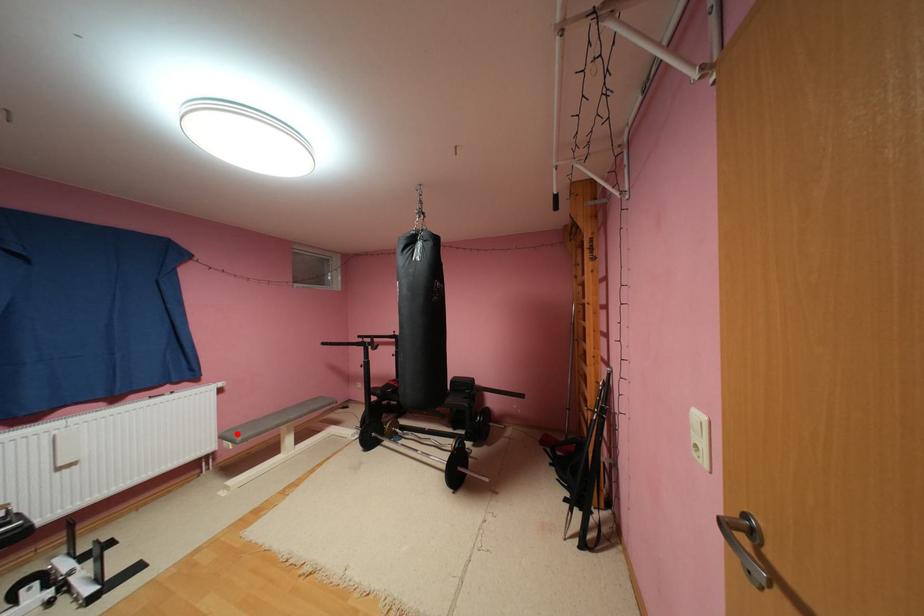
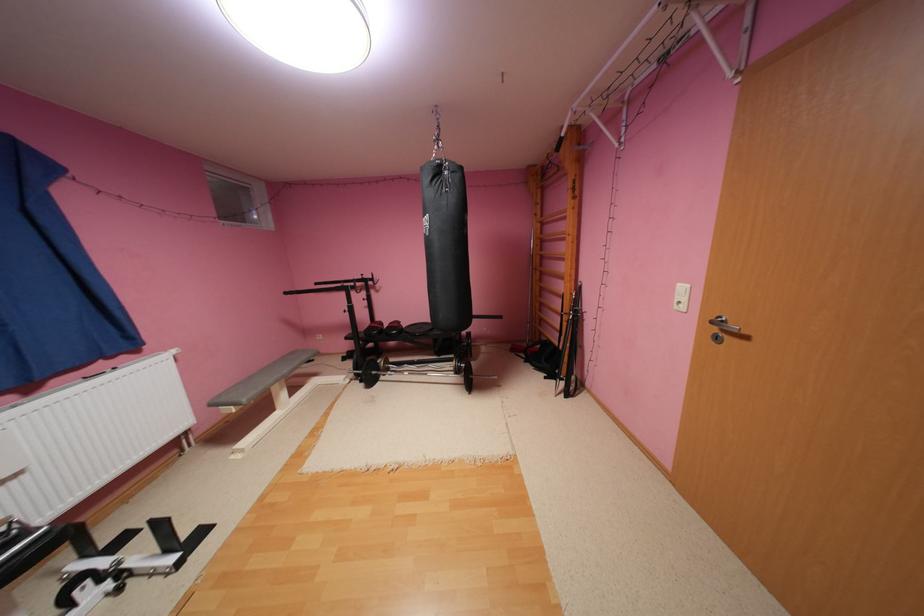
Locate, in the second image, the point that corresponds to the highlighted location in the first image.

(233, 399)